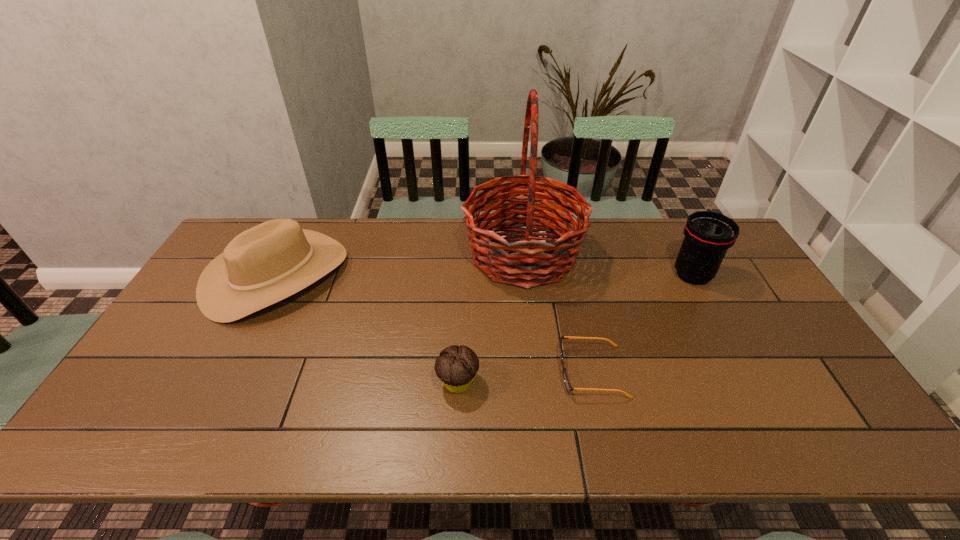
Identify the location of vacant space located 0.200m on the front of the third shortest object. (219, 387).

The width and height of the screenshot is (960, 540). What are the coordinates of `free spot located 0.270m on the back of the muffin` in the screenshot? It's located at (462, 292).

At what (x,y) coordinates should I click in order to perform the action: click on vacant area situated 0.120m on the front-facing side of the spectacles. Please return your answer as a coordinate pair (x, y). Looking at the image, I should click on click(513, 372).

You are a GUI agent. You are given a task and a screenshot of the screen. Output one action in this format:
    pyautogui.click(x=<x>, y=<y>)
    Task: Click on the vacant region located on the front-facing side of the spectacles
    This screenshot has width=960, height=540.
    Given the screenshot: What is the action you would take?
    pyautogui.click(x=410, y=372)

Where is `vacant space located 0.110m on the front-facing side of the spectacles`? vacant space located 0.110m on the front-facing side of the spectacles is located at coordinates (516, 372).

Locate an element on the screen. The width and height of the screenshot is (960, 540). basket that is at the far edge is located at coordinates (513, 262).

This screenshot has height=540, width=960. Identify the location of telephoto lens positioned at the far edge. (708, 235).

Locate an element on the screen. This screenshot has height=540, width=960. cowboy hat present at the far edge is located at coordinates (267, 263).

This screenshot has height=540, width=960. In order to click on object positioned at the left edge in this screenshot , I will do `click(267, 263)`.

Identify the location of object that is positioned at the right edge. (708, 235).